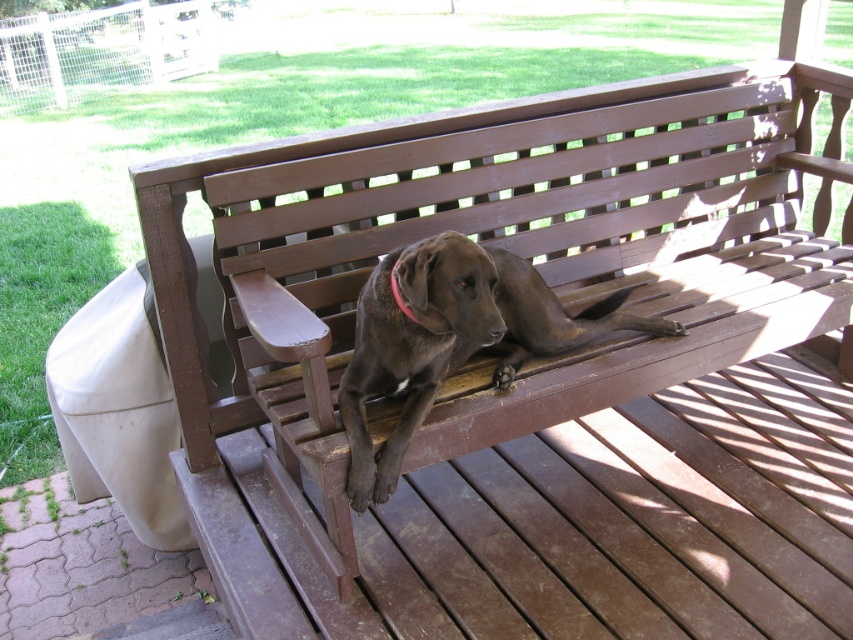
You are standing at the origin point in the image. Where is the brown wooden bench at center located in terms of coordinates?

The brown wooden bench at center is located at coordinates point (514, 250).

You are a painter standing on the wooden deck. You want to place a small stool next to the brown wooden bench at center so that it doesn not block the view of the pink fabric neckband at center. Where should you place the stool relative to the bench?

The brown wooden bench at center is much taller than the pink fabric neckband at center. To avoid blocking the view of the pink fabric neckband at center, place the stool in front of the bench so that the neckband remains visible behind the bench.